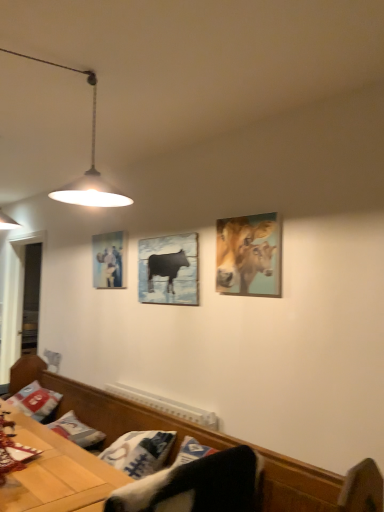
Question: Can you confirm if golden textured cows at upper right is smaller than wooden table at lower left?

Choices:
 (A) no
 (B) yes

Answer: (B)

Question: Is golden textured cows at upper right located outside wooden table at lower left?

Choices:
 (A) yes
 (B) no

Answer: (A)

Question: Would you consider golden textured cows at upper right to be distant from wooden table at lower left?

Choices:
 (A) yes
 (B) no

Answer: (A)

Question: Is golden textured cows at upper right in contact with wooden table at lower left?

Choices:
 (A) no
 (B) yes

Answer: (A)

Question: Can you confirm if golden textured cows at upper right is thinner than wooden table at lower left?

Choices:
 (A) no
 (B) yes

Answer: (B)

Question: Is wooden bench at lower center wider or thinner than white cotton pillow at lower left?

Choices:
 (A) thin
 (B) wide

Answer: (B)

Question: Is wooden bench at lower center inside or outside of white cotton pillow at lower left?

Choices:
 (A) outside
 (B) inside

Answer: (A)

Question: From the image's perspective, relative to white cotton pillow at lower left, is wooden bench at lower center above or below?

Choices:
 (A) above
 (B) below

Answer: (B)

Question: Does point (221, 445) appear closer or farther from the camera than point (31, 392)?

Choices:
 (A) farther
 (B) closer

Answer: (B)

Question: Based on their positions, is matte black cow at center, which is the second picture frame from left to right, located to the left or right of golden textured cows at upper right?

Choices:
 (A) left
 (B) right

Answer: (A)

Question: Considering their positions, is matte black cow at center, the first picture frame when ordered from front to back, located in front of or behind golden textured cows at upper right?

Choices:
 (A) front
 (B) behind

Answer: (B)

Question: From their relative heights in the image, would you say matte black cow at center, which ranks as the 1th picture frame in right-to-left order, is taller or shorter than golden textured cows at upper right?

Choices:
 (A) tall
 (B) short

Answer: (A)

Question: Considering the positions of matte black cow at center, the first picture frame when ordered from front to back, and golden textured cows at upper right in the image, is matte black cow at center, the first picture frame when ordered from front to back, wider or thinner than golden textured cows at upper right?

Choices:
 (A) wide
 (B) thin

Answer: (B)

Question: Based on their sizes in the image, would you say metallic pendant light at upper left is bigger or smaller than matte black cow at center, the first picture frame when ordered from front to back?

Choices:
 (A) small
 (B) big

Answer: (B)

Question: Is point (64, 193) closer or farther from the camera than point (142, 239)?

Choices:
 (A) closer
 (B) farther

Answer: (A)